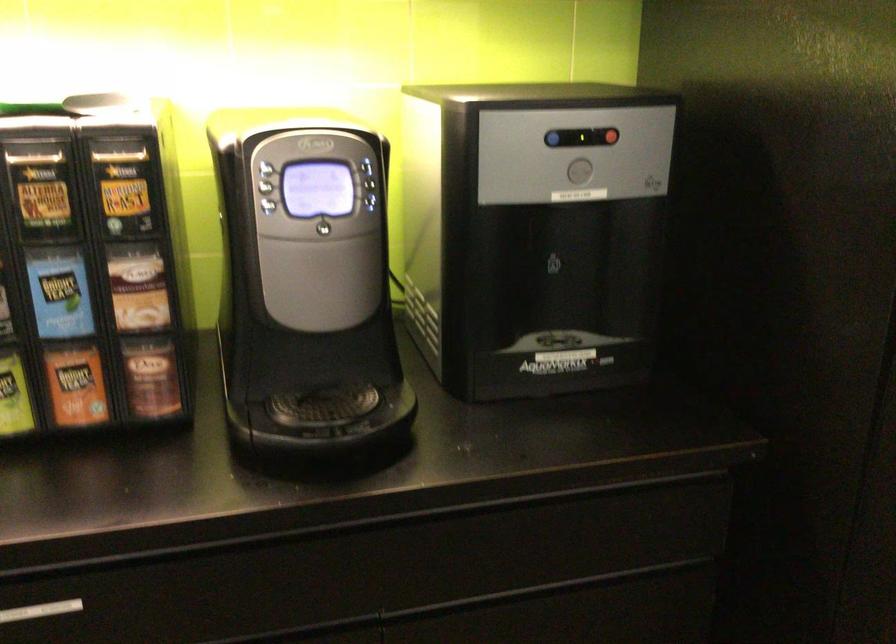
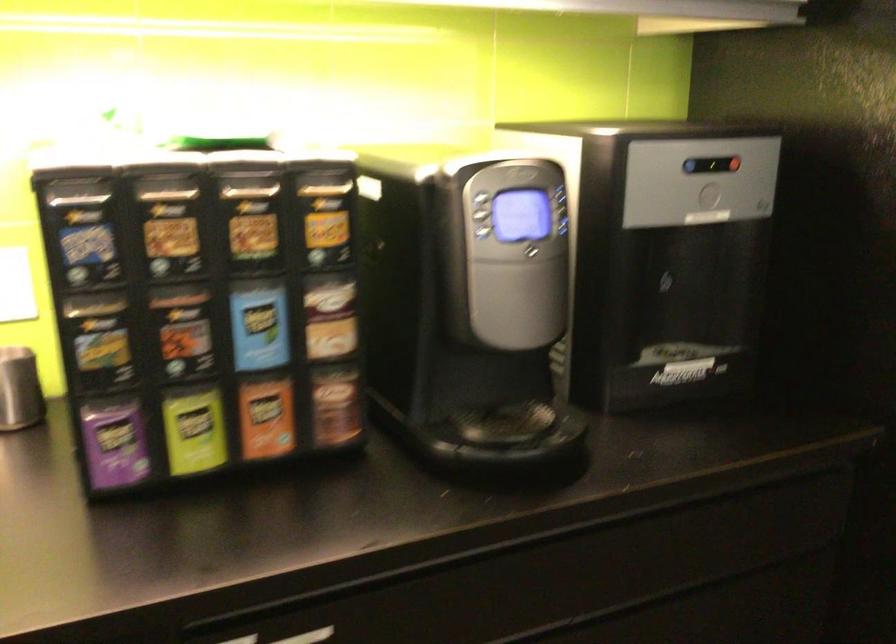
In the second image, find the point that corresponds to (271,205) in the first image.

(486, 232)